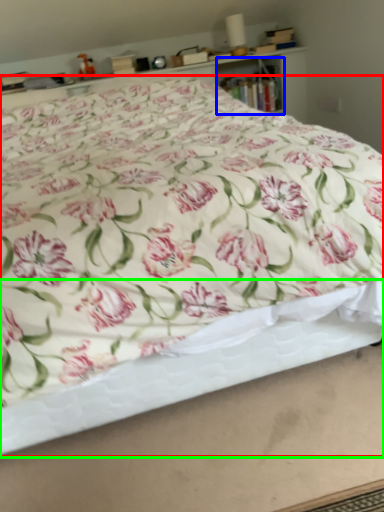
Question: Which object is positioned farthest from bed (highlighted by a red box)? Select from cabinet (highlighted by a blue box) and bed frame (highlighted by a green box).

Choices:
 (A) cabinet
 (B) bed frame

Answer: (A)